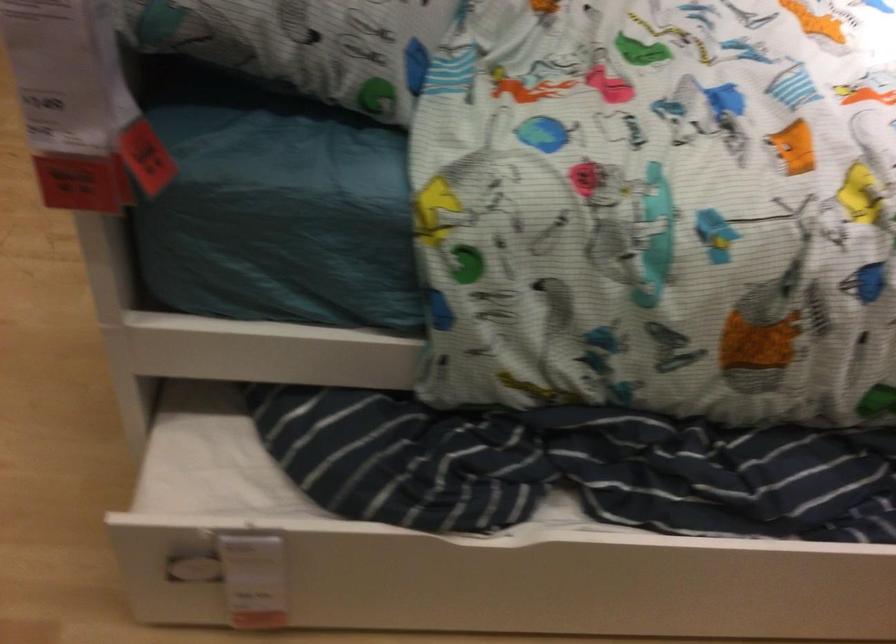
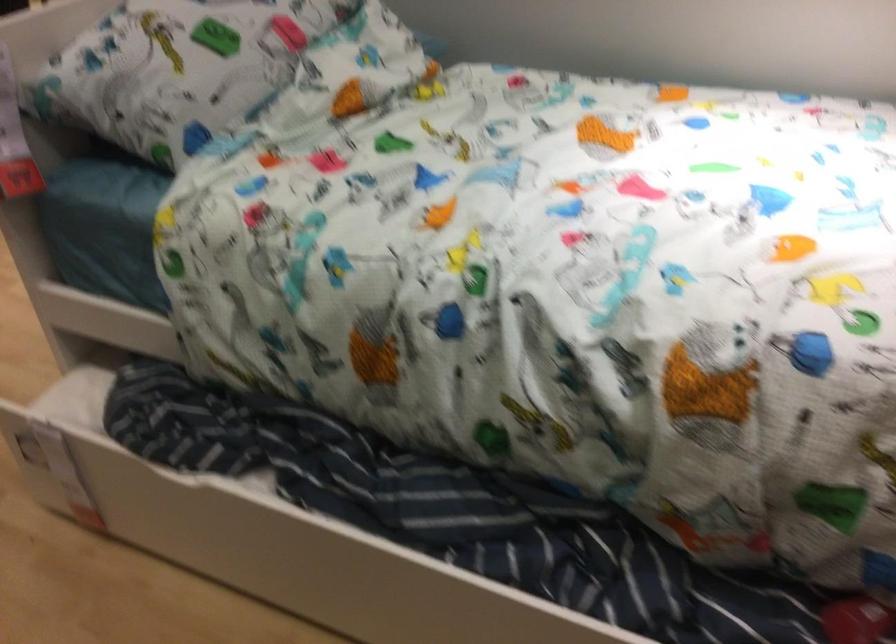
Locate, in the second image, the point that corresponds to [153,569] in the first image.

(24, 448)